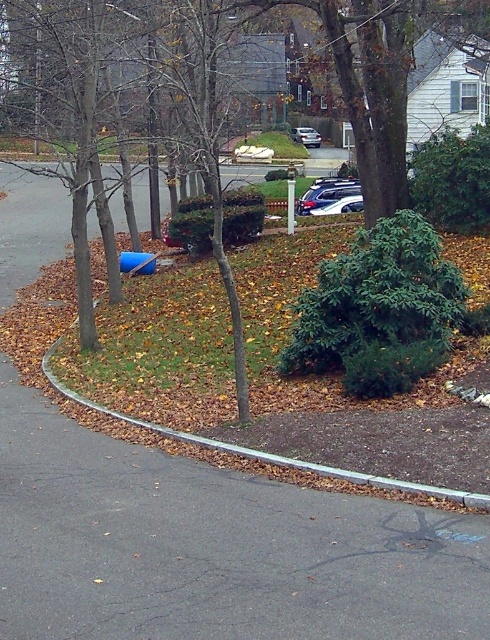
Question: Among these objects, which one is farthest from the camera?

Choices:
 (A) brown textured tree at center
 (B) green leafy tree at center
 (C) gray concrete curb at lower center
 (D) satin silver sedan at center

Answer: (D)

Question: Which object is the closest to the satin silver sedan at upper center?

Choices:
 (A) gray concrete curb at lower center
 (B) green leafy tree at center

Answer: (B)

Question: Can you confirm if green leafy tree at center is positioned below gray concrete curb at lower center?

Choices:
 (A) no
 (B) yes

Answer: (A)

Question: Which point is farther from the camera taking this photo?

Choices:
 (A) (239, 24)
 (B) (66, 4)

Answer: (A)

Question: Is green leafy tree at center to the right of satin silver suv at center from the viewer's perspective?

Choices:
 (A) yes
 (B) no

Answer: (B)

Question: Can you confirm if brown textured tree at center is positioned below satin silver sedan at center?

Choices:
 (A) no
 (B) yes

Answer: (A)